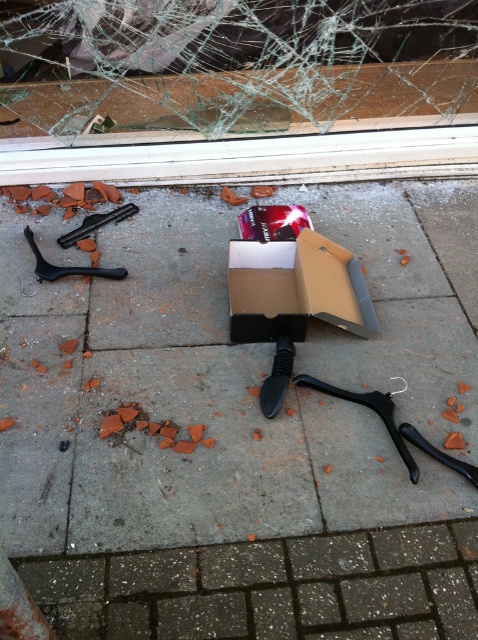
You are a delivery person who needs to place a new package in the damaged storefront. The new package is 18 inches long. Can you fit it between the brown cardboard box at center and the black plastic hanger at left without moving either?

The distance between the brown cardboard box at center and the black plastic hanger at left is 21.80 inches. Since the new package is 18 inches long, it can fit within that space without needing to move either object.

You are a repair technician assessing damage to a storefront. You see the transparent glass windshield at upper center and the black plastic tool at left. Which object is bigger in size?

The transparent glass windshield at upper center is larger in size compared to the black plastic tool at left.